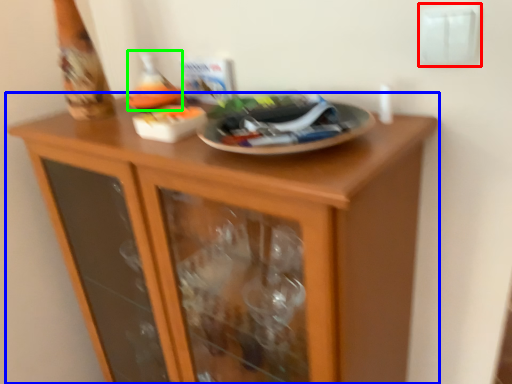
Question: Based on their relative distances, which object is nearer to electric outlet (highlighted by a red box)? Choose from cupboard (highlighted by a blue box) and wine bottle (highlighted by a green box).

Choices:
 (A) cupboard
 (B) wine bottle

Answer: (B)